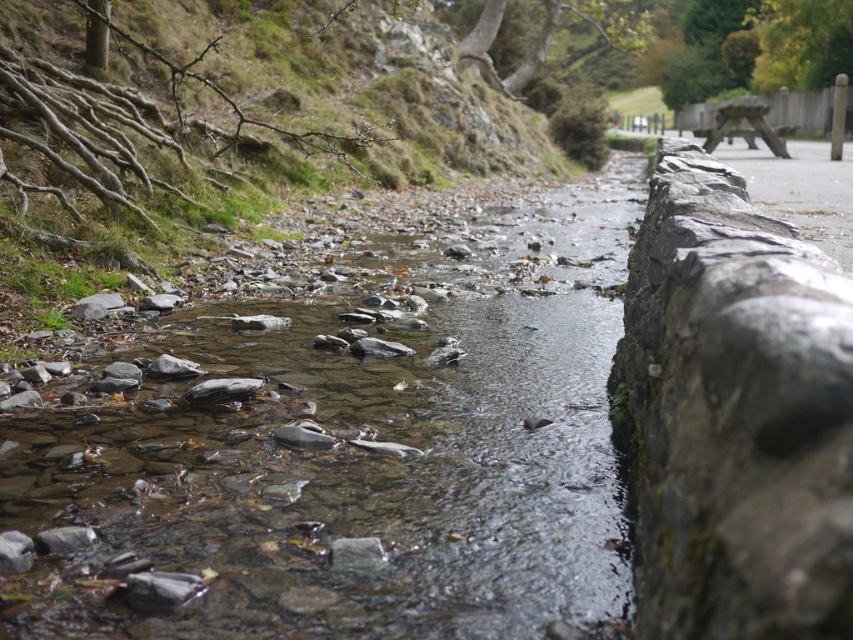
Question: Observing the image, what is the correct spatial positioning of clear water at center in reference to gray stone wall at right?

Choices:
 (A) below
 (B) above

Answer: (A)

Question: Which point is farther to the camera?

Choices:
 (A) gray stone wall at right
 (B) clear water at center

Answer: (B)

Question: Does clear water at center have a lesser width compared to gray stone wall at right?

Choices:
 (A) yes
 (B) no

Answer: (A)

Question: Is clear water at center smaller than gray stone wall at right?

Choices:
 (A) yes
 (B) no

Answer: (A)